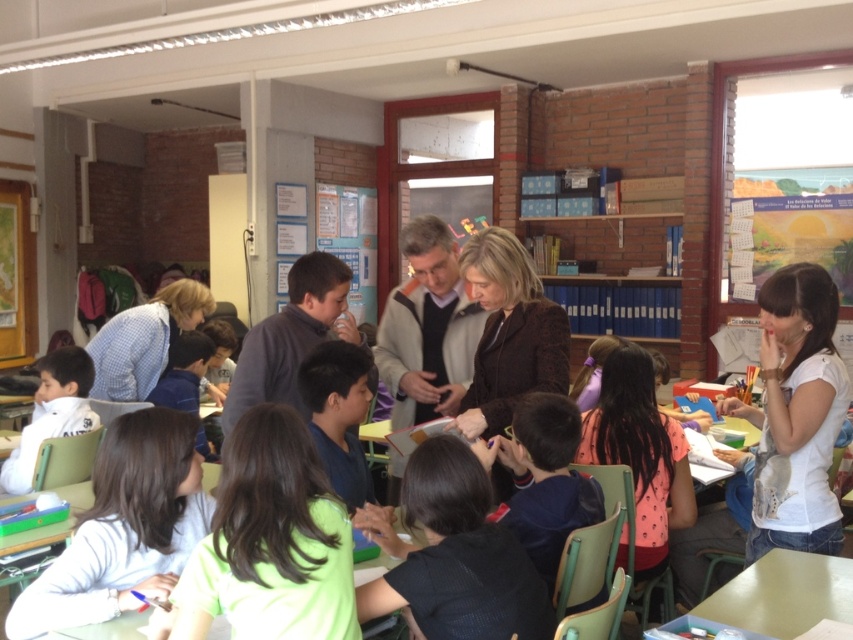
You are a student sitting at the back of the classroom. You notice two points marked on the whiteboard. The first point is at coordinates point (x=426, y=480) and the second is at point (x=410, y=285). Which point do you think is closer to you?

The point at coordinates point (x=426, y=480) is closer to you since it is closer to the camera than point (x=410, y=285).

You are a student in the classroom and need to ask a question. You are currently sitting at your desk and see the dark green shirt at center and the dark brown sweater at center. Which adult should you approach if you want to ask a question, and why?

You should approach the adult wearing the dark green shirt at center because they are closer to you than the dark brown sweater at center. The distance between them is 3.72 feet, so the dark green shirt at center is nearer to your desk.

You are a student in the classroom and want to know which object takes up more space in the image. Which one is larger between the green fabric shirt at center and the green matte table at lower right?

The green fabric shirt at center is bigger than the green matte table at lower right, so the green fabric shirt at center takes up more space in the image.